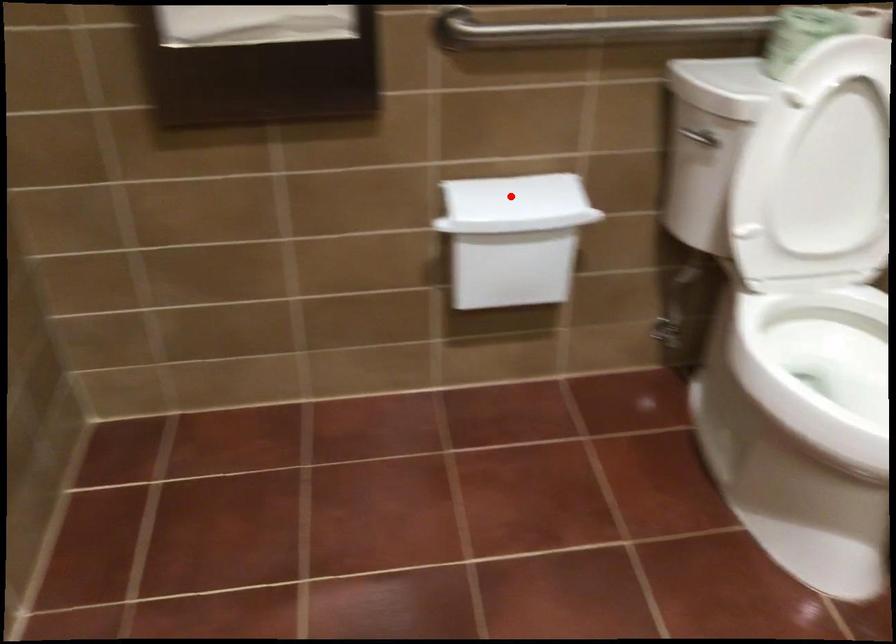
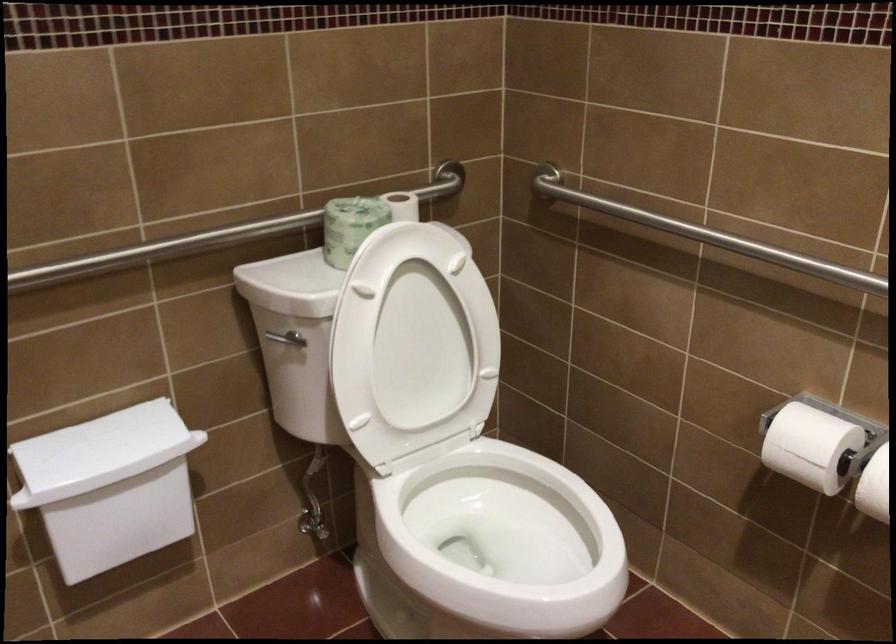
The point at the highlighted location is marked in the first image. Where is the corresponding point in the second image?

(100, 450)